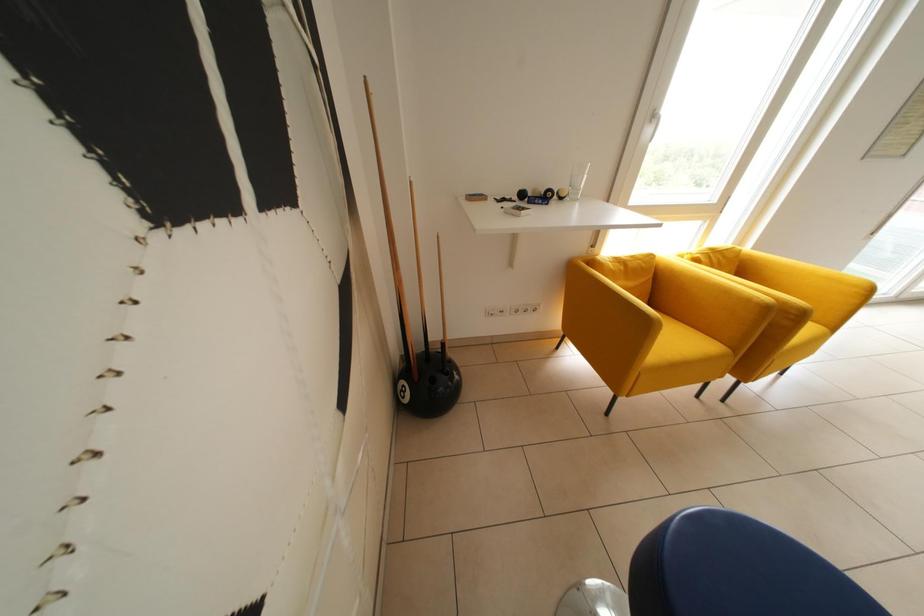
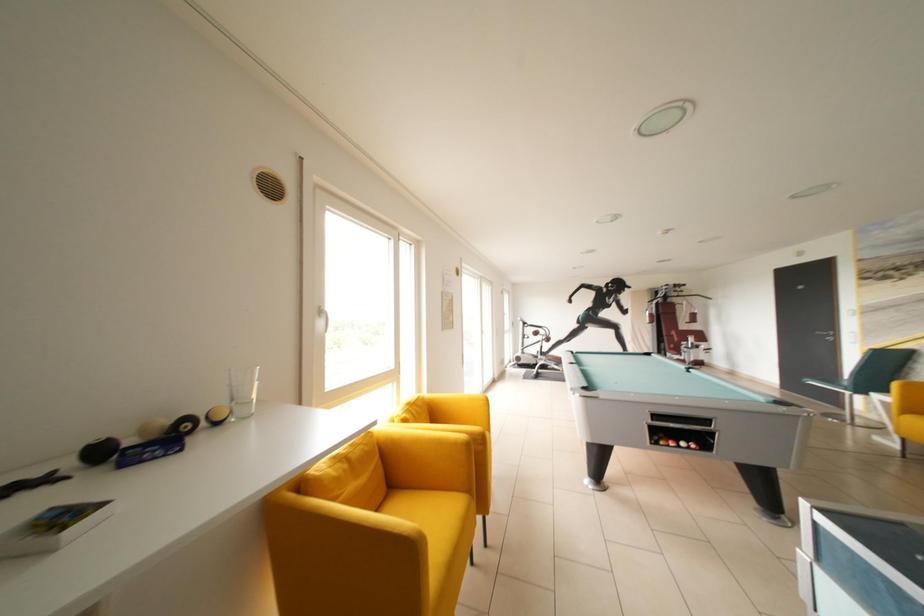
How did the camera likely rotate?

The camera rotated toward right-up.